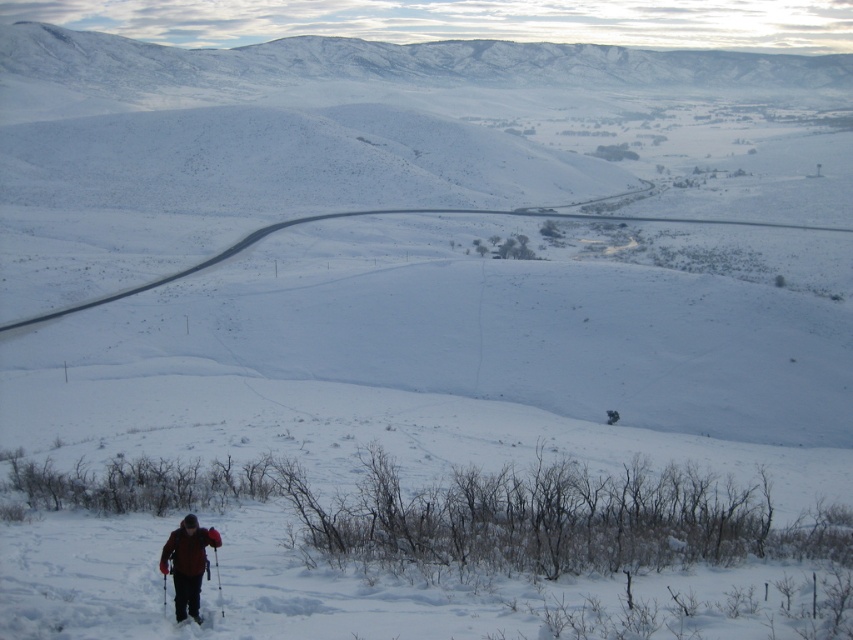
Can you confirm if red fleece jacket at lower left is positioned to the left of black matte ski at lower left?

Yes, red fleece jacket at lower left is to the left of black matte ski at lower left.

Can you confirm if red fleece jacket at lower left is positioned below black matte ski at lower left?

Yes.

I want to click on red fleece jacket at lower left, so click(x=187, y=563).